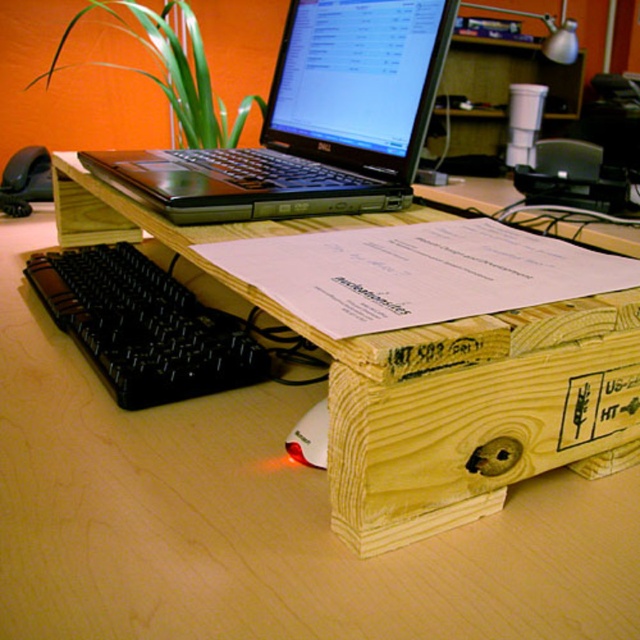
Please provide the coordinates of the black matte laptop at upper center in the image coordinate system where the origin is at the bottom left corner of the image. The coordinates are represented as a tuple of two decimal numbers between 0 and 1, with the first number indicating the horizontal position and the second number indicating the vertical position.

The coordinates of the black matte laptop at upper center are at point (312, 122).

What are the coordinates of the black plastic keyboard at lower left?

The coordinates of the black plastic keyboard at lower left are at point (144,326).